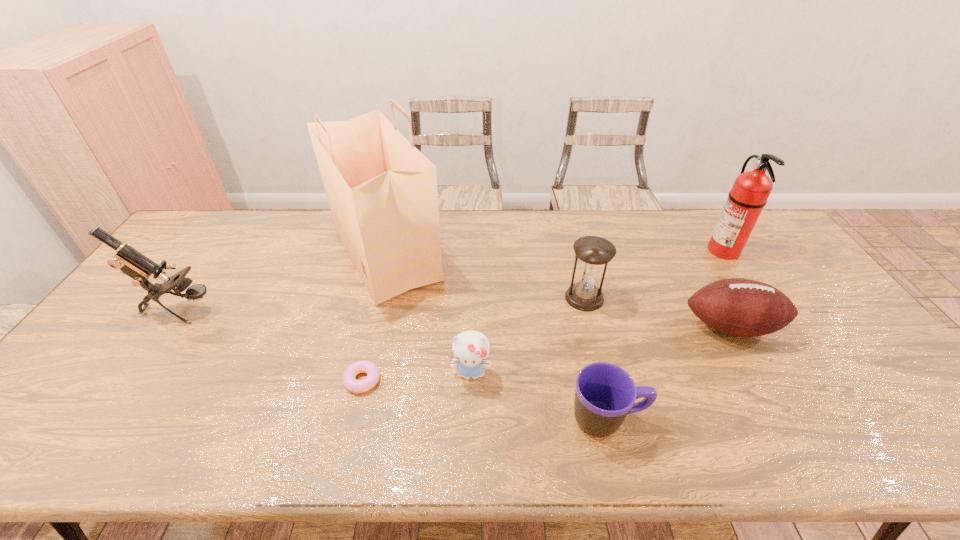
This screenshot has height=540, width=960. I want to click on vacant region located at the nozzle of the fire extinguisher, so click(666, 250).

Where is `vacant space positioned 0.060m at the nozzle of the fire extinguisher`? Image resolution: width=960 pixels, height=540 pixels. vacant space positioned 0.060m at the nozzle of the fire extinguisher is located at coordinates (689, 250).

Find the location of a particular element. vacant space situated 0.260m at the nozzle of the fire extinguisher is located at coordinates (630, 250).

Identify the location of free space located through the eyepiece of the microscope. (282, 310).

I want to click on vacant space located on the back of the hourglass, so click(567, 231).

Where is `vacant space situated 0.200m on the left of the football (American)`? The image size is (960, 540). vacant space situated 0.200m on the left of the football (American) is located at coordinates (610, 327).

Find the location of a particular element. This screenshot has width=960, height=540. vacant space situated 0.100m on the front-facing side of the fifth object from right to left is located at coordinates (469, 426).

You are a GUI agent. You are given a task and a screenshot of the screen. Output one action in this format:
    pyautogui.click(x=<x>, y=<y>)
    Task: Click on the vacant region located with the handle on the side of the nearest object
    This screenshot has width=960, height=540.
    Given the screenshot: What is the action you would take?
    pyautogui.click(x=684, y=420)

This screenshot has width=960, height=540. Identify the location of free location located 0.320m on the back of the shortest object. (386, 281).

You are a GUI agent. You are given a task and a screenshot of the screen. Output one action in this format:
    pyautogui.click(x=<x>, y=<y>)
    Task: Click on the grocery bag that is at the far edge
    
    Given the screenshot: What is the action you would take?
    pyautogui.click(x=382, y=191)